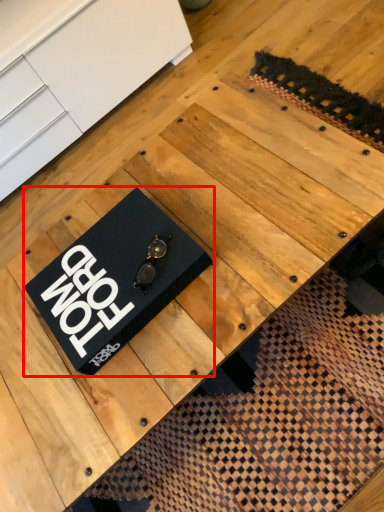
Question: From the image's perspective, what is the correct spatial relationship of plaque (annotated by the red box) in relation to furniture?

Choices:
 (A) below
 (B) above

Answer: (A)